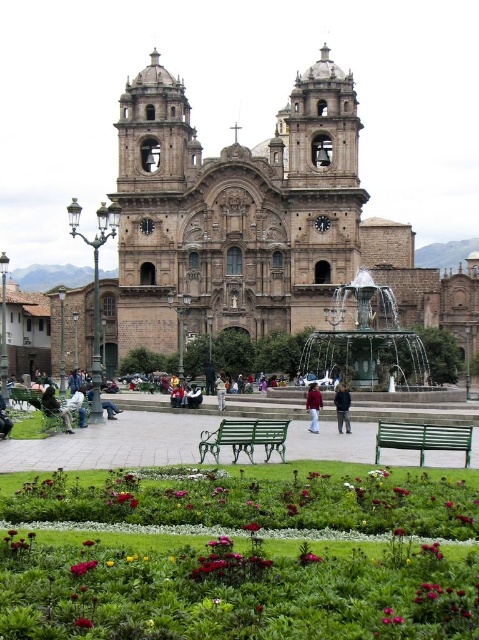
You are a tourist visiting the historic church and need to rest. You see the green painted wood park bench at lower right and the smooth pink rose at lower center. Which object is bigger in size?

The green painted wood park bench at lower right is larger in size compared to the smooth pink rose at lower center.

You are standing in the plaza in front of the historic church. You see two points marked in the image. The first point is at coordinate point (192, 394) and the second point is at coordinate point (83, 545). From your current position, which point is closer to the church?

Point (192, 394) is behind point (83, 545), so the point closer to the church is point (192, 394).